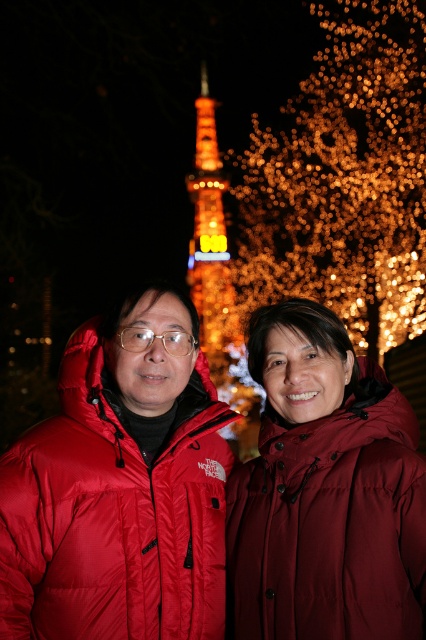
Who is taller, burgundy matte jacket at center or illuminated glass tower at center?

illuminated glass tower at center is taller.

Which is in front, point (342, 563) or point (218, 204)?

Point (342, 563)

Locate an element on the screen. This screenshot has height=640, width=426. burgundy matte jacket at center is located at coordinates (325, 492).

From the picture: Does illuminated golden lights at upper center appear over illuminated glass tower at center?

Correct, illuminated golden lights at upper center is located above illuminated glass tower at center.

Is illuminated golden lights at upper center smaller than illuminated glass tower at center?

No, illuminated golden lights at upper center is not smaller than illuminated glass tower at center.

Is point (302, 214) farther from camera compared to point (198, 172)?

That is False.

The image size is (426, 640). Identify the location of illuminated golden lights at upper center. (344, 179).

Who is taller, burgundy matte jacket at center or matte red puffer jacket at center?

burgundy matte jacket at center

Image resolution: width=426 pixels, height=640 pixels. What do you see at coordinates (325, 492) in the screenshot? I see `burgundy matte jacket at center` at bounding box center [325, 492].

Is point (374, 586) positioned in front of point (134, 472)?

Yes.

Image resolution: width=426 pixels, height=640 pixels. I want to click on burgundy matte jacket at center, so click(x=325, y=492).